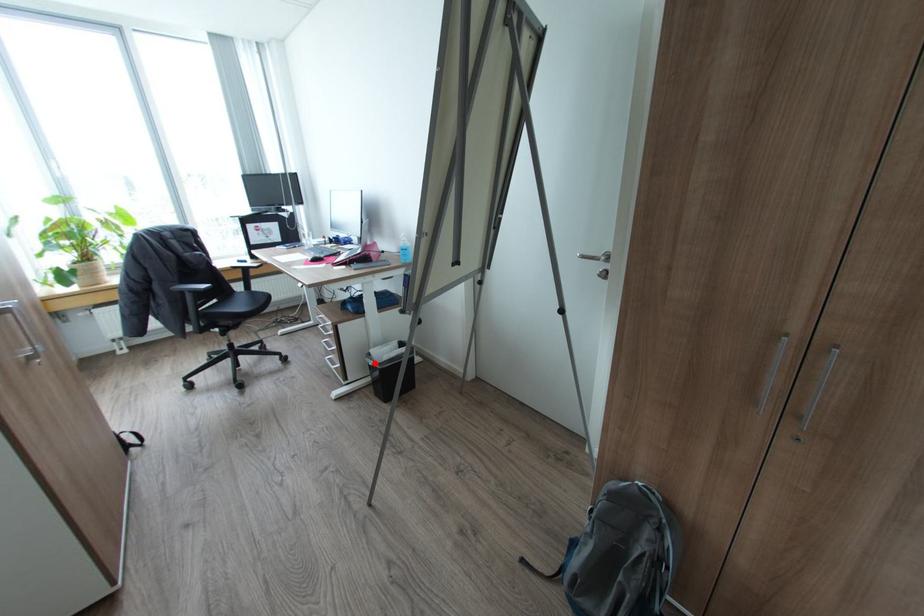
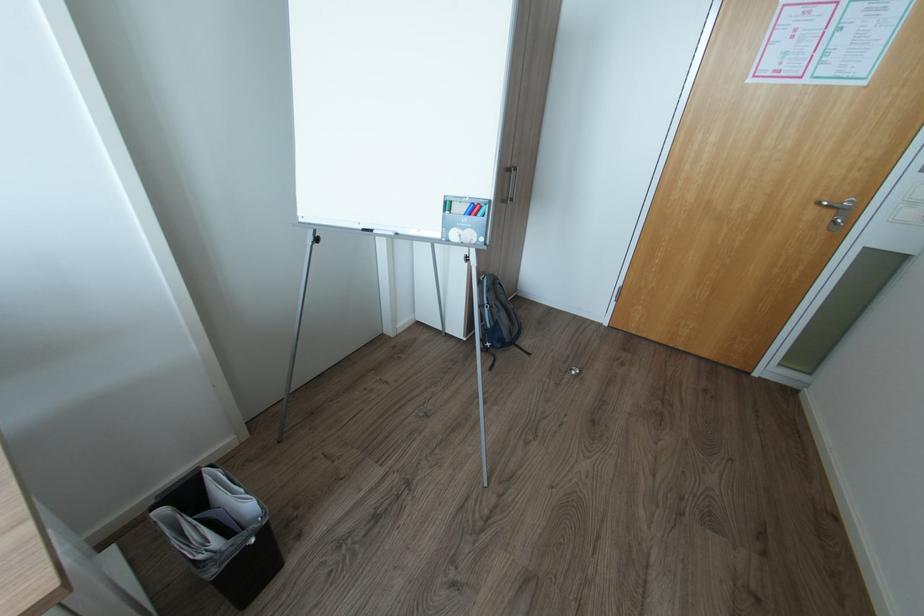
Question: I am providing you with two images of the same scene from different viewpoints. Image1 has a red point marked. In image2, the corresponding 3D location appears at what relative position? Reply with the corresponding letter.

Choices:
 (A) Closer
 (B) Farther

Answer: (A)